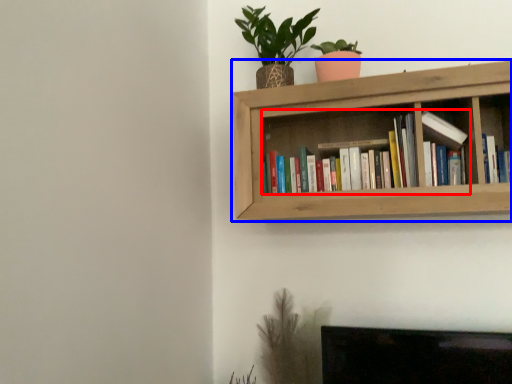
Question: Which of the following is the farthest to the observer, book (highlighted by a red box) or shelf (highlighted by a blue box)?

Choices:
 (A) book
 (B) shelf

Answer: (A)